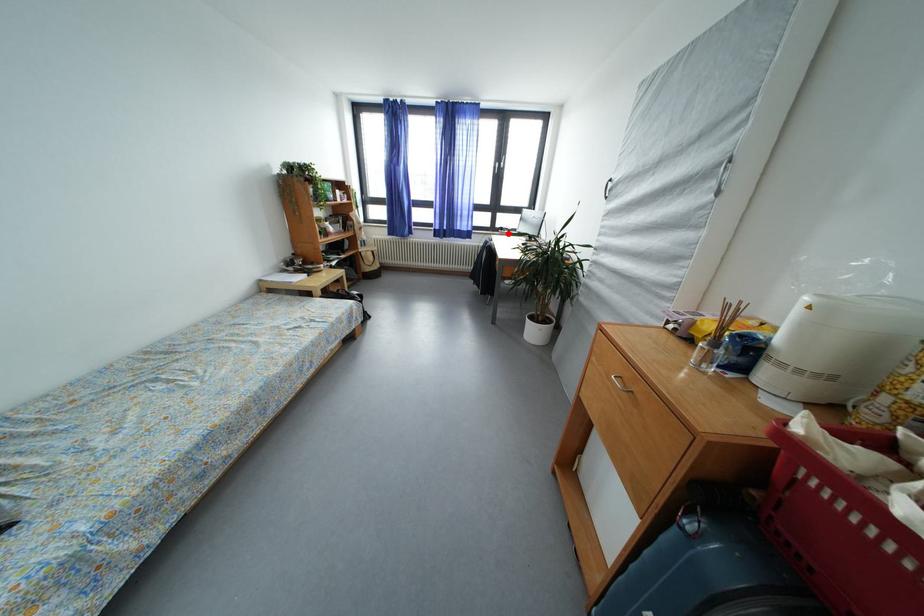
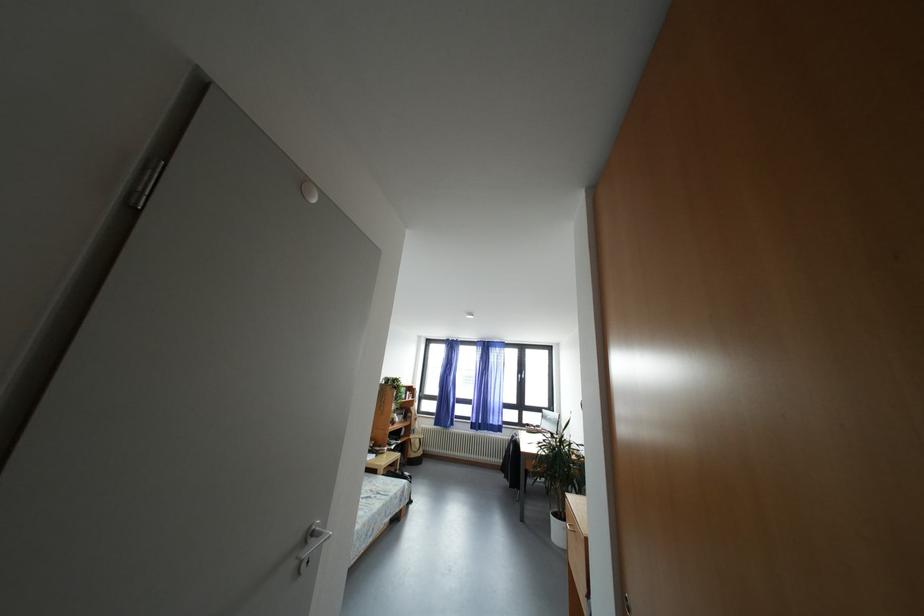
Where in the second image is the point corresponding to the highlighted location from the first image?

(533, 430)